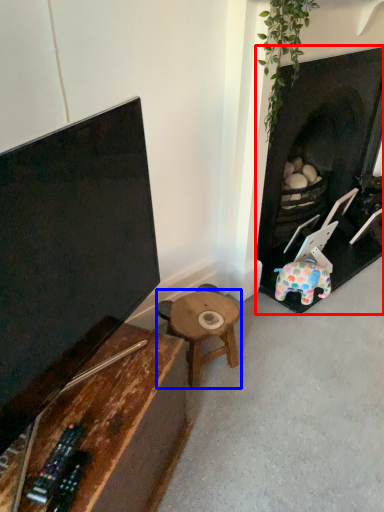
Question: Which object is further to the camera taking this photo, fireplace (highlighted by a red box) or table (highlighted by a blue box)?

Choices:
 (A) fireplace
 (B) table

Answer: (B)